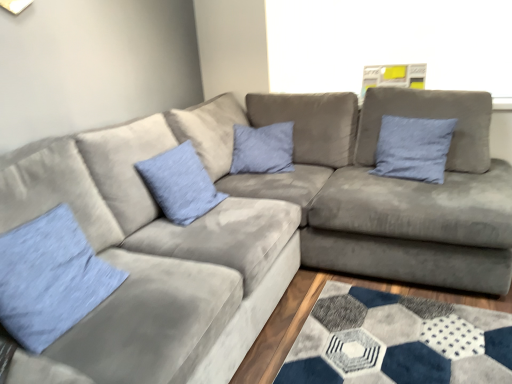
Question: Would you say light blue fabric pillow at lower left, the first pillow from the front, is to the left or to the right of blue fabric pillow at upper right, the first pillow in the back-to-front sequence, in the picture?

Choices:
 (A) left
 (B) right

Answer: (A)

Question: Is light blue fabric pillow at lower left, which is counted as the 3th pillow, starting from the right, in front of or behind blue fabric pillow at upper right, the first pillow in the back-to-front sequence, in the image?

Choices:
 (A) behind
 (B) front

Answer: (B)

Question: Considering the real-world distances, which object is closest to the blue fabric pillow at center, which appears as the second pillow when viewed from the right?

Choices:
 (A) light blue fabric pillow at lower left, which is counted as the 3th pillow, starting from the right
 (B) blue fabric pillow at upper right, the first pillow in the right-to-left sequence

Answer: (A)

Question: Which of these objects is positioned closest to the blue fabric pillow at upper right, which is the third pillow in left-to-right order?

Choices:
 (A) light blue fabric pillow at lower left, which is counted as the 3th pillow, starting from the right
 (B) blue fabric pillow at center, which is counted as the 2th pillow, starting from the back

Answer: (B)